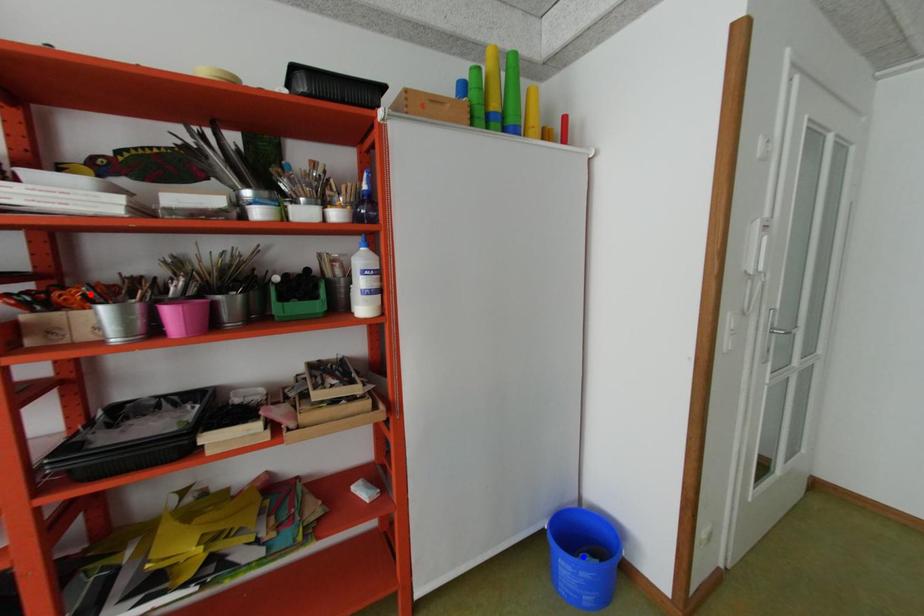
Question: Which of the two points in the image is closer to the camera?

Choices:
 (A) Blue point is closer.
 (B) Red point is closer.

Answer: (B)